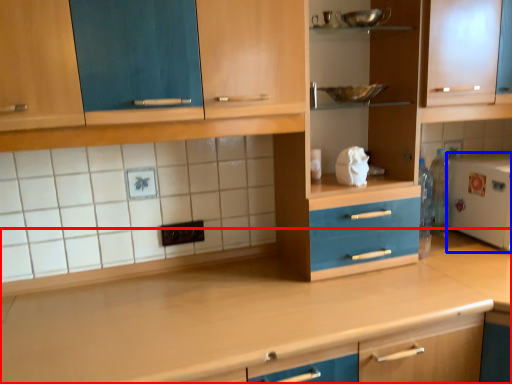
Question: Which object is further to the camera taking this photo, countertop (highlighted by a red box) or appliance (highlighted by a blue box)?

Choices:
 (A) countertop
 (B) appliance

Answer: (B)